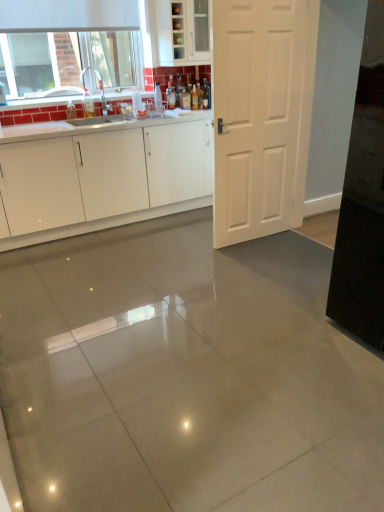
Question: Can you confirm if translucent amber bottle at upper center, which is the 3th bottle from left to right, is thinner than white matte door at center?

Choices:
 (A) yes
 (B) no

Answer: (A)

Question: Is translucent amber bottle at upper center, which is the 3th bottle from left to right, far from white matte door at center?

Choices:
 (A) yes
 (B) no

Answer: (A)

Question: Could you tell me if translucent amber bottle at upper center, which is the 3th bottle from left to right, is turned towards white matte door at center?

Choices:
 (A) no
 (B) yes

Answer: (B)

Question: From the image's perspective, is translucent amber bottle at upper center, which is the 3th bottle from left to right, under white matte door at center?

Choices:
 (A) no
 (B) yes

Answer: (A)

Question: Can white matte door at center be found inside translucent amber bottle at upper center, which is the 3th bottle from left to right?

Choices:
 (A) no
 (B) yes

Answer: (A)

Question: From a real-world perspective, is translucent glass bottle at center, placed as the fourth bottle when sorted from left to right, positioned above or below white matte exhaust hood at upper left?

Choices:
 (A) above
 (B) below

Answer: (B)

Question: Considering the positions of point (203, 98) and point (117, 23), is point (203, 98) closer or farther from the camera than point (117, 23)?

Choices:
 (A) closer
 (B) farther

Answer: (B)

Question: Is translucent glass bottle at center, placed as the 1th bottle when sorted from right to left, bigger or smaller than white matte exhaust hood at upper left?

Choices:
 (A) small
 (B) big

Answer: (A)

Question: In the image, is translucent glass bottle at center, placed as the 1th bottle when sorted from right to left, on the left side or the right side of white matte exhaust hood at upper left?

Choices:
 (A) right
 (B) left

Answer: (A)

Question: From a real-world perspective, is white glossy cabinetry at center, marked as the 2th cabinetry in a top-to-bottom arrangement, physically located above or below translucent glass bottle at center, the second bottle viewed from the left?

Choices:
 (A) below
 (B) above

Answer: (A)

Question: Is point (84, 193) closer or farther from the camera than point (170, 92)?

Choices:
 (A) farther
 (B) closer

Answer: (B)

Question: In the image, is white glossy cabinetry at center, the first cabinetry positioned from the bottom, positioned in front of or behind translucent glass bottle at center, the second bottle viewed from the left?

Choices:
 (A) front
 (B) behind

Answer: (A)

Question: Considering the relative positions of white glossy cabinetry at center, the first cabinetry positioned from the bottom, and translucent glass bottle at center, the third bottle when ordered from right to left, in the image provided, is white glossy cabinetry at center, the first cabinetry positioned from the bottom, to the left or to the right of translucent glass bottle at center, the third bottle when ordered from right to left,?

Choices:
 (A) left
 (B) right

Answer: (A)

Question: Considering the positions of translucent glass bottle at center, placed as the 1th bottle when sorted from right to left, and translucent amber bottle at upper center, which is the 3th bottle from left to right, in the image, is translucent glass bottle at center, placed as the 1th bottle when sorted from right to left, taller or shorter than translucent amber bottle at upper center, which is the 3th bottle from left to right,?

Choices:
 (A) short
 (B) tall

Answer: (B)

Question: Choose the correct answer: Is translucent glass bottle at center, placed as the fourth bottle when sorted from left to right, inside translucent amber bottle at upper center, positioned as the 2th bottle in right-to-left order, or outside it?

Choices:
 (A) inside
 (B) outside

Answer: (B)